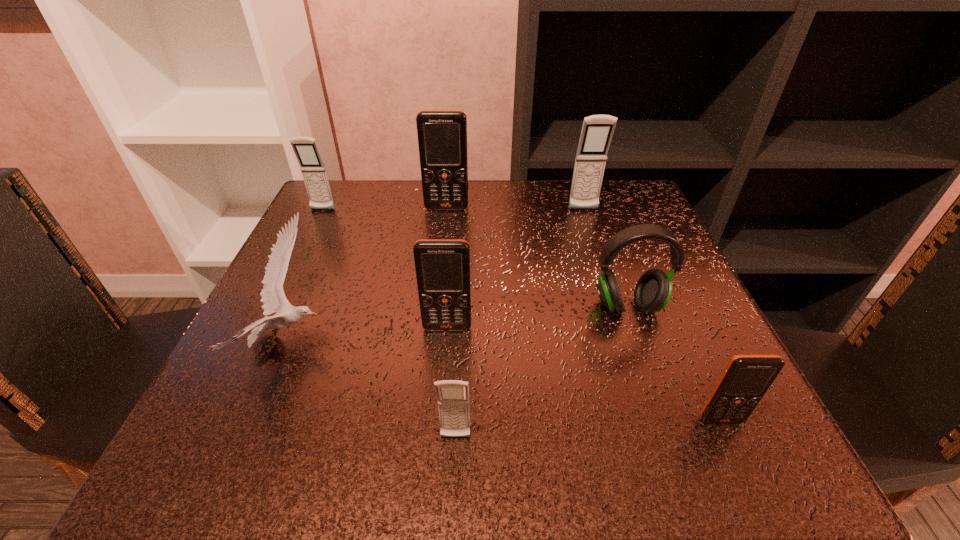
Locate an element on the screen. The image size is (960, 540). the rightmost orange cellular telephone is located at coordinates (746, 378).

Where is `the nearest object`? The image size is (960, 540). the nearest object is located at coordinates (453, 395).

Image resolution: width=960 pixels, height=540 pixels. In order to click on the second gray cellular telephone from right to left in this screenshot , I will do `click(453, 395)`.

Image resolution: width=960 pixels, height=540 pixels. I want to click on free location located 0.190m on the front-facing side of the second cellular telephone from right to left, so click(x=602, y=267).

I want to click on vacant space situated 0.240m on the screen of the biggest orange cellular telephone, so click(x=439, y=281).

You are a GUI agent. You are given a task and a screenshot of the screen. Output one action in this format:
    pyautogui.click(x=<x>, y=<y>)
    Task: Click on the free space located 0.200m on the front-facing side of the leftmost gray cellular telephone
    The height and width of the screenshot is (540, 960).
    Given the screenshot: What is the action you would take?
    pyautogui.click(x=293, y=270)

I want to click on vacant space located 0.090m on the screen of the second smallest orange cellular telephone, so click(x=444, y=377).

At what (x,y) coordinates should I click in order to perform the action: click on vacant region located on the ear cups of the headset. Please return your answer as a coordinate pair (x, y). Looking at the image, I should click on pos(662,406).

I want to click on vacant point located at the tip of the beak of the gull, so click(x=548, y=341).

Image resolution: width=960 pixels, height=540 pixels. Identify the location of gull at the near edge. [x=273, y=298].